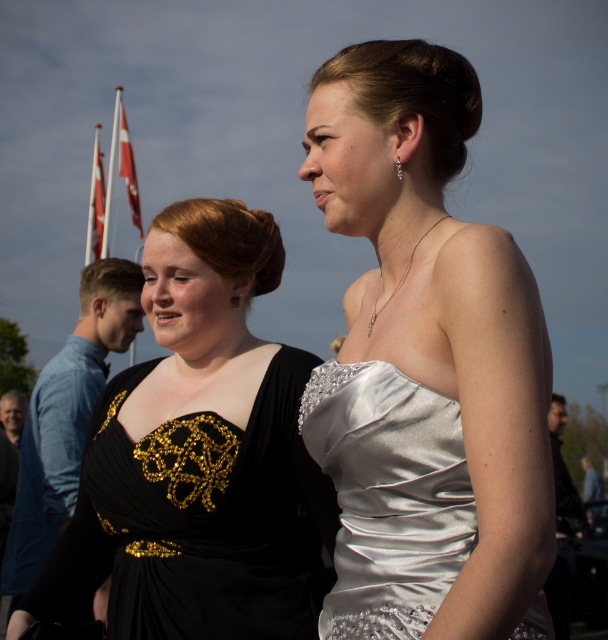
Question: Among these points, which one is nearest to the camera?

Choices:
 (A) (119, 173)
 (B) (395, 472)
 (C) (385, 362)
 (D) (88, 220)

Answer: (B)

Question: Does satin dress at upper right appear on the left side of black satin dress at center?

Choices:
 (A) yes
 (B) no

Answer: (B)

Question: Which object is closer to the camera taking this photo?

Choices:
 (A) red fabric flag at upper left
 (B) white fabric flag at upper left

Answer: (B)

Question: Estimate the real-world distances between objects in this image. Which object is closer to the white fabric flag at upper left?

Choices:
 (A) red fabric flag at upper left
 (B) satin dress at upper right

Answer: (A)

Question: In this image, where is black satin dress at center located relative to red fabric flag at upper left?

Choices:
 (A) right
 (B) left

Answer: (A)

Question: Does satin dress at upper right have a greater width compared to satin dress at center?

Choices:
 (A) no
 (B) yes

Answer: (A)